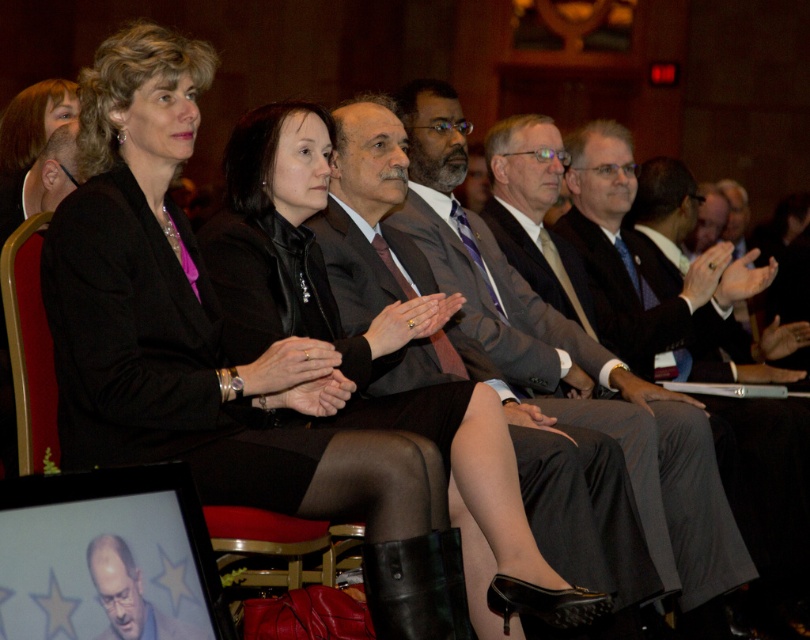
Describe the element at coordinates (572, 369) in the screenshot. I see `matte gray suit at center` at that location.

Can you confirm if matte gray suit at center is positioned to the left of smooth bald head at center?

Incorrect, matte gray suit at center is not on the left side of smooth bald head at center.

Is point (633, 460) more distant than point (135, 570)?

Yes, it is.

The height and width of the screenshot is (640, 810). I want to click on matte gray suit at center, so click(x=572, y=369).

Is matte black jacket at center wider than gray suit at center?

Incorrect, matte black jacket at center's width does not surpass gray suit at center's.

The height and width of the screenshot is (640, 810). I want to click on matte black jacket at center, so click(x=216, y=353).

Based on the photo, between matte gray suit at center and gray suit at center, which one is positioned lower?

Result: matte gray suit at center is lower down.

Who is more distant from viewer, (467, 129) or (798, 534)?

The point (467, 129) is more distant.

In order to click on matte gray suit at center in this screenshot , I will do `click(572, 369)`.

In order to click on matte gray suit at center in this screenshot , I will do tap(572, 369).